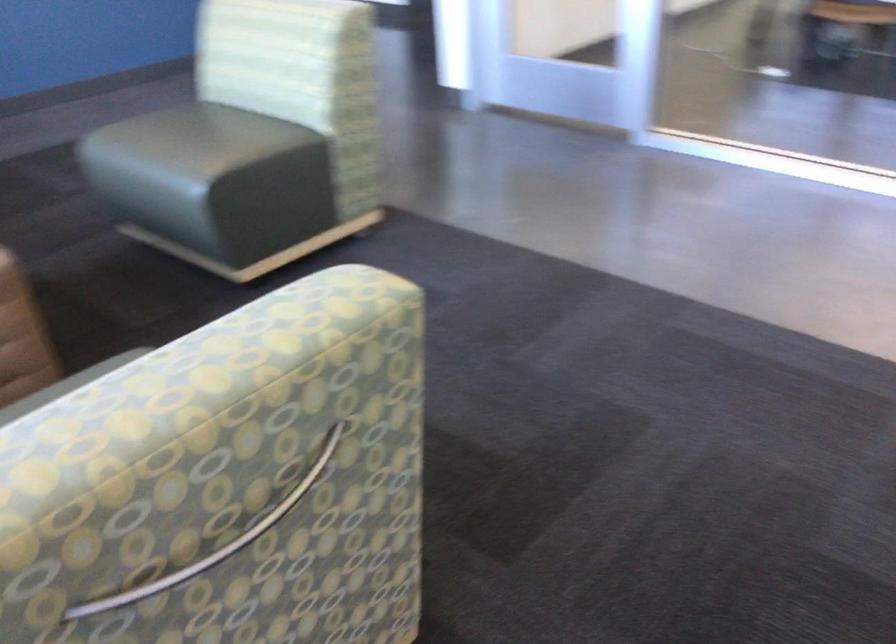
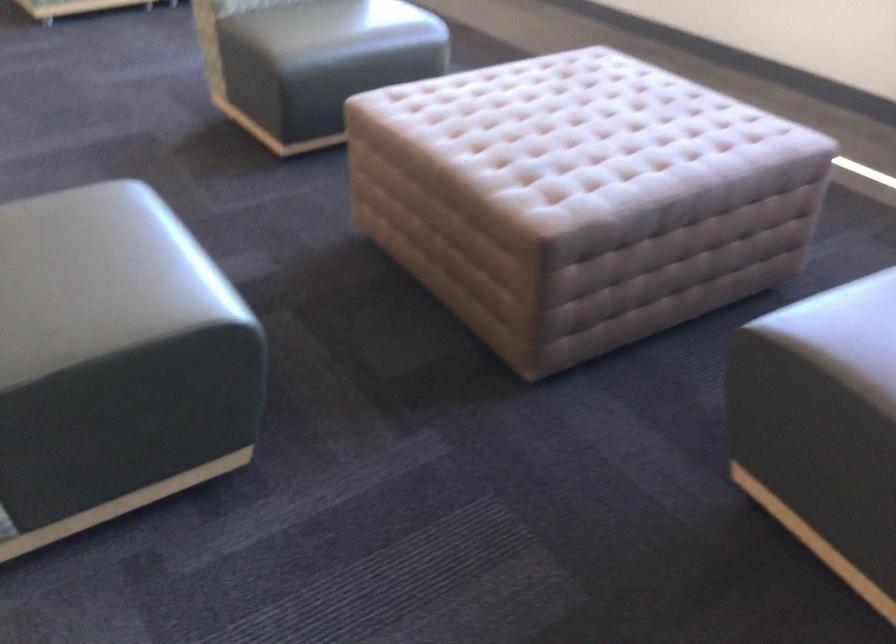
Locate, in the second image, the point that corresponds to point (191, 118) in the first image.

(99, 278)